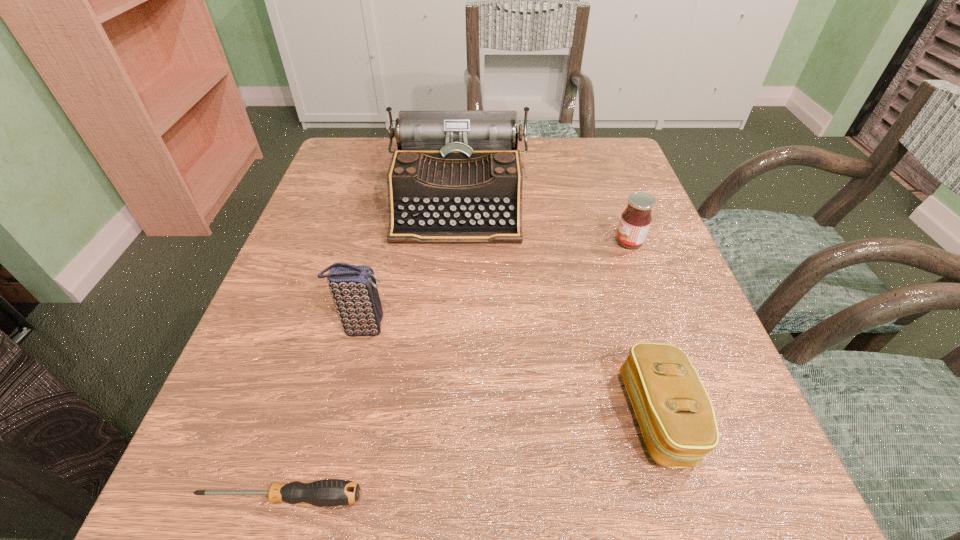
Identify the location of clutch bag at the left edge. Image resolution: width=960 pixels, height=540 pixels. (355, 293).

The width and height of the screenshot is (960, 540). I want to click on screwdriver at the left edge, so click(330, 492).

I want to click on jam that is at the right edge, so click(x=635, y=221).

The height and width of the screenshot is (540, 960). Identify the location of clutch bag located in the right edge section of the desktop. (675, 414).

This screenshot has height=540, width=960. In order to click on object situated at the near left corner in this screenshot , I will do `click(330, 492)`.

This screenshot has height=540, width=960. In order to click on object that is at the near right corner in this screenshot , I will do `click(675, 414)`.

At what (x,y) coordinates should I click in order to perform the action: click on vacant space at the near edge of the desktop. Please return your answer as a coordinate pair (x, y). Looking at the image, I should click on (379, 534).

This screenshot has height=540, width=960. I want to click on vacant point at the left edge, so click(220, 456).

This screenshot has height=540, width=960. What are the coordinates of `vacant space at the right edge of the desktop` in the screenshot? It's located at (612, 343).

In the image, there is a desktop. What are the coordinates of `vacant region at the far right corner` in the screenshot? It's located at (576, 163).